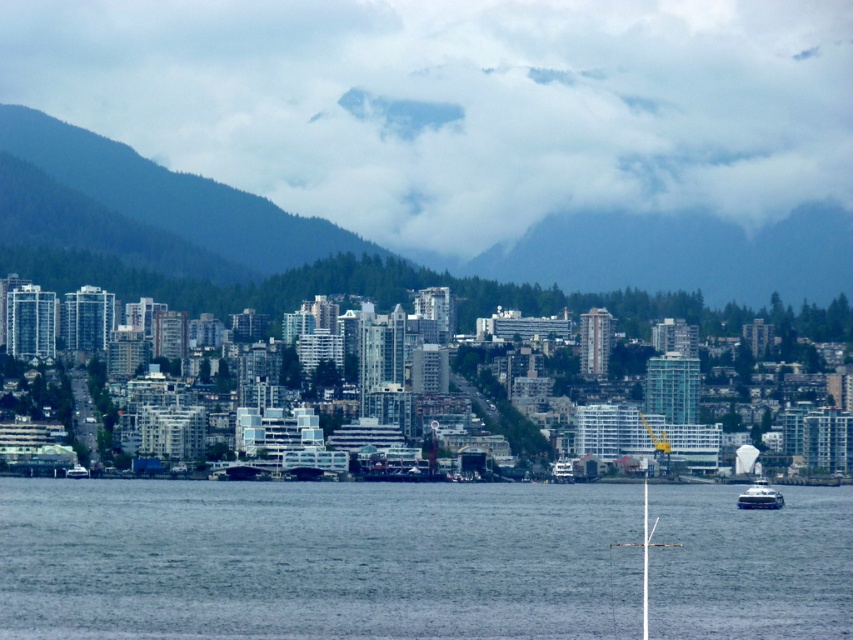
Question: Does cloudy fog at upper center appear under white glossy ferry at lower right?

Choices:
 (A) yes
 (B) no

Answer: (B)

Question: Does green forested mountain at upper left have a lesser width compared to white glossy ferry at lower right?

Choices:
 (A) yes
 (B) no

Answer: (B)

Question: Which of these objects is positioned closest to the cloudy fog at upper center?

Choices:
 (A) green forested mountain at upper left
 (B) blue water at lower center
 (C) white glossy ferry at lower right

Answer: (A)

Question: Can you confirm if green forested mountain at upper left is positioned to the left of white glossy ferry at lower right?

Choices:
 (A) yes
 (B) no

Answer: (A)

Question: Among these points, which one is nearest to the camera?

Choices:
 (A) (115, 513)
 (B) (219, 211)
 (C) (749, 488)
 (D) (115, 88)

Answer: (B)

Question: Which object is farther from the camera taking this photo?

Choices:
 (A) blue water at lower center
 (B) green forested mountain at upper left

Answer: (A)